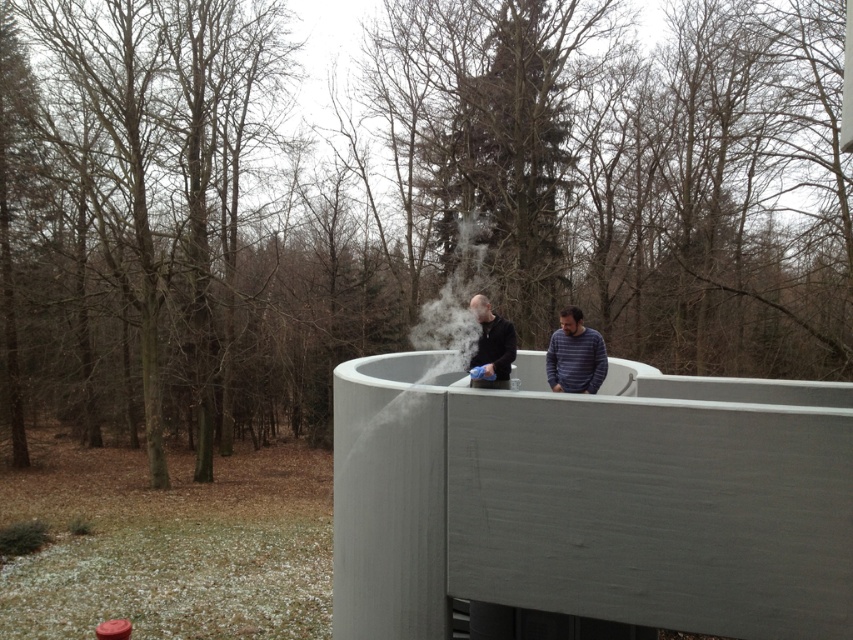
You are a delivery drone that needs to deliver a package to the person at the center of the curved structure. The package is 15 feet long. Can you safely land between the white vapor at center and the striped cotton shirt at center without the package overlapping either object?

The distance between the white vapor at center and the striped cotton shirt at center is 15.28 feet. Since the package is 15 feet long, it can fit within the space between them without overlapping either object.

You are an architect designing a new observation deck. In the image provided, where is the matte black clothing at center located in terms of coordinates?

The matte black clothing at center is located at coordinates point (x=575, y=355).